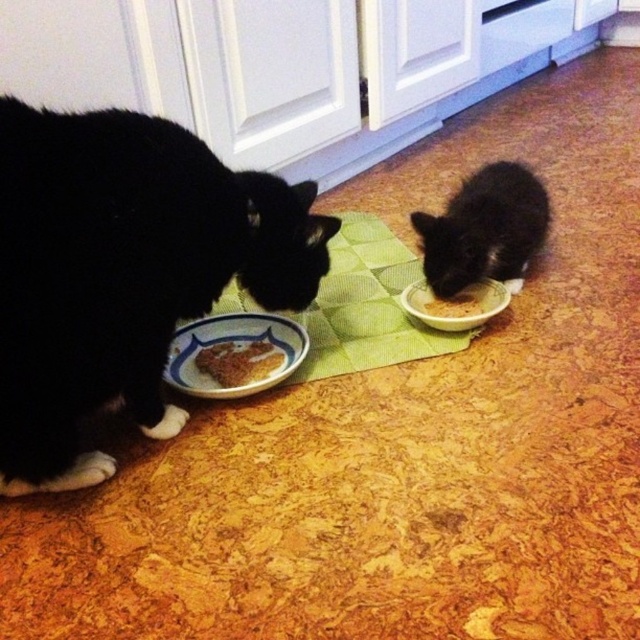
You are a pet owner who wants to clean the kitchen floor. You need to move the black matte fur cat at lower right and the brown crumbly food at lower left first. Which object should you move first to reach the floor area behind them?

The black matte fur cat at lower right is located above brown crumbly food at lower left, so you should move the black matte fur cat at lower right first to access the floor area behind both objects.

You are a cat owner who wants to ensure your cats have enough space between their food bowls to prevent them from fighting. The minimum recommended distance between bowls is 30 centimeters. Based on the scene, is the distance between the brown matte bowl at center and the brown crumbly food at lower left sufficient?

The distance between the brown matte bowl at center and the brown crumbly food at lower left is 37.40 centimeters, which is greater than the minimum recommended 30 centimeters. Therefore, the distance is sufficient to prevent fighting.